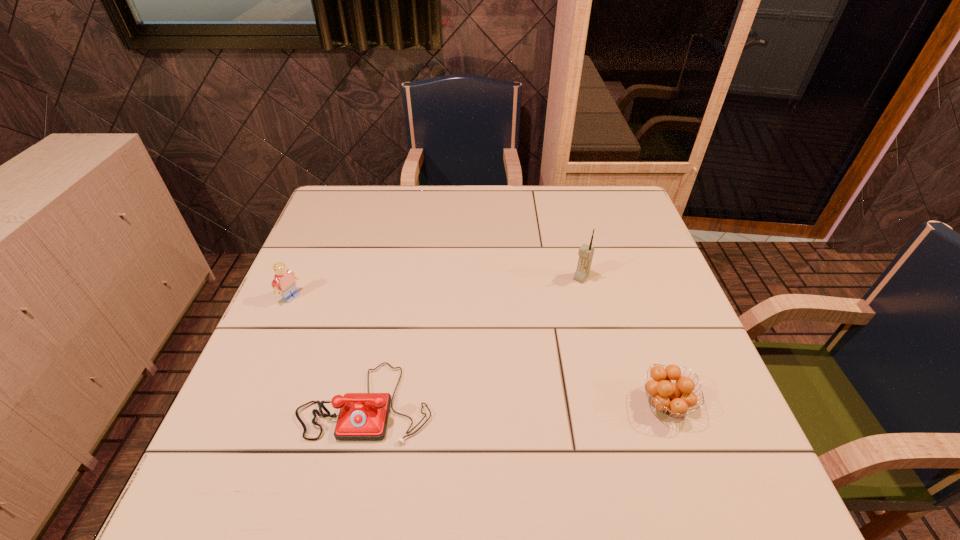
Image resolution: width=960 pixels, height=540 pixels. I want to click on vacant space situated on the front-facing side of the Lego, so click(397, 356).

Where is `vacant space situated 0.330m on the front-facing side of the Lego`? This screenshot has height=540, width=960. vacant space situated 0.330m on the front-facing side of the Lego is located at coordinates (401, 358).

Where is `vacant space located on the front-facing side of the Lego`? This screenshot has width=960, height=540. vacant space located on the front-facing side of the Lego is located at coordinates (416, 366).

Locate an element on the screen. The height and width of the screenshot is (540, 960). telephone located at the near edge is located at coordinates (363, 416).

At what (x,y) coordinates should I click in order to perform the action: click on orange fruit that is at the near edge. Please return your answer as a coordinate pair (x, y). Image resolution: width=960 pixels, height=540 pixels. Looking at the image, I should click on (673, 398).

Find the location of a particular element. This screenshot has height=540, width=960. telephone that is at the left edge is located at coordinates (363, 416).

The width and height of the screenshot is (960, 540). What are the coordinates of `Lego located at the left edge` in the screenshot? It's located at (284, 279).

The height and width of the screenshot is (540, 960). What are the coordinates of `object that is at the right edge` in the screenshot? It's located at (673, 398).

Where is `object at the near left corner`? object at the near left corner is located at coordinates (363, 416).

This screenshot has width=960, height=540. What are the coordinates of `object at the near right corner` in the screenshot? It's located at (673, 398).